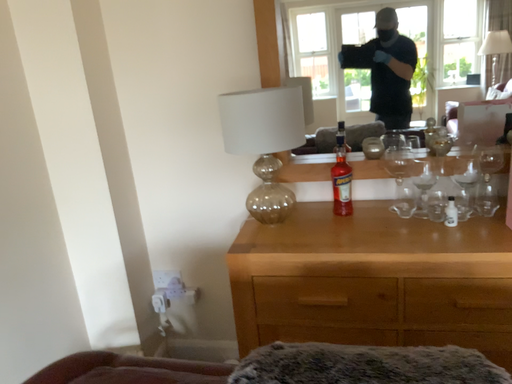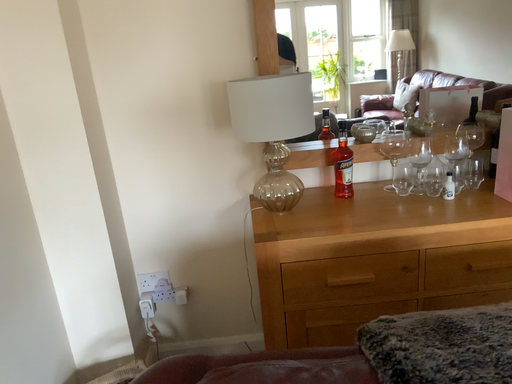
Question: Which way did the camera rotate in the video?

Choices:
 (A) rotated right
 (B) rotated left

Answer: (A)